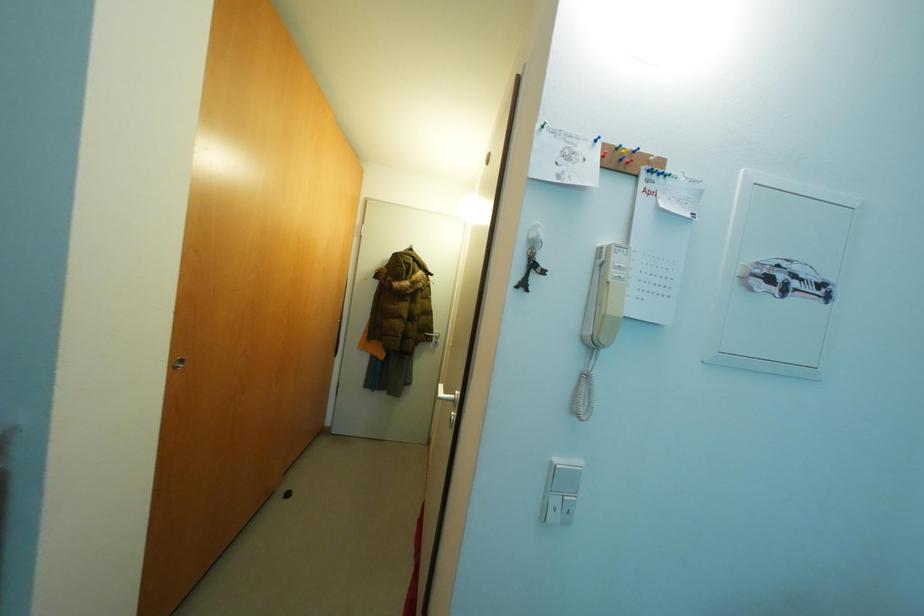
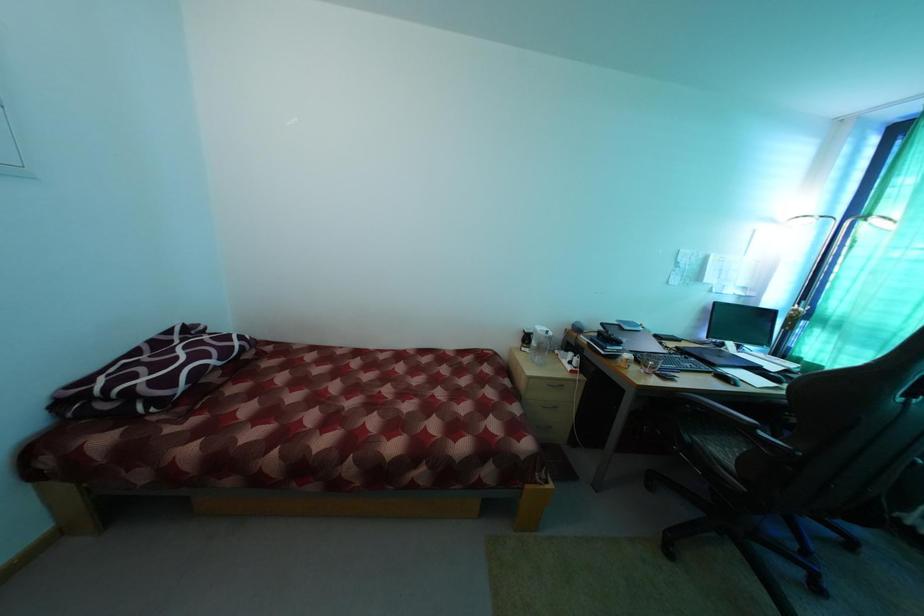
How did the camera likely rotate?

The camera rotated toward right-down.